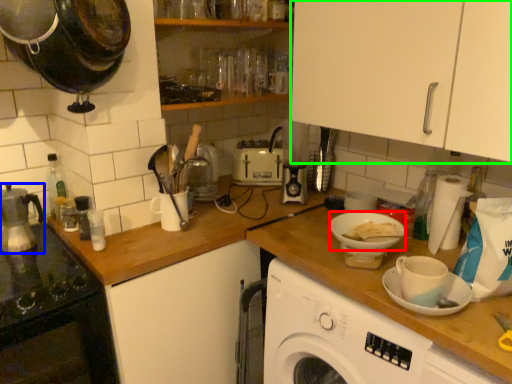
Question: Estimate the real-world distances between objects in this image. Which object is farther from tableware (highlighted by a red box), kitchen appliance (highlighted by a blue box) or cabinetry (highlighted by a green box)?

Choices:
 (A) kitchen appliance
 (B) cabinetry

Answer: (A)